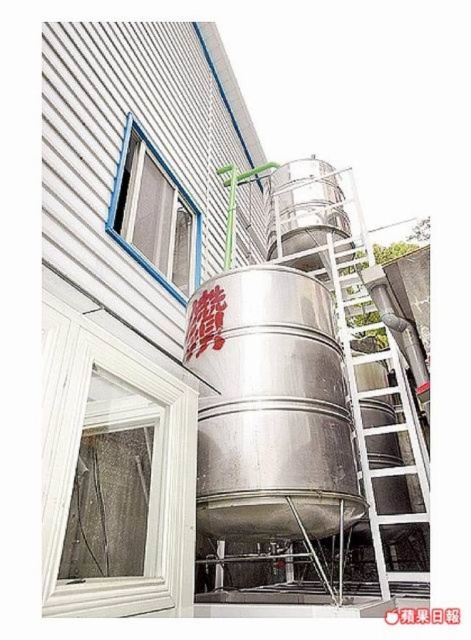
Question: Can you confirm if metallic ladder at right is positioned to the right of blue plastic window at upper left?

Choices:
 (A) no
 (B) yes

Answer: (B)

Question: Which point appears closest to the camera in this image?

Choices:
 (A) (129, 236)
 (B) (358, 324)

Answer: (A)

Question: Can you confirm if metallic ladder at right is positioned to the right of blue plastic window at upper left?

Choices:
 (A) no
 (B) yes

Answer: (B)

Question: Is metallic ladder at right above blue plastic window at upper left?

Choices:
 (A) yes
 (B) no

Answer: (B)